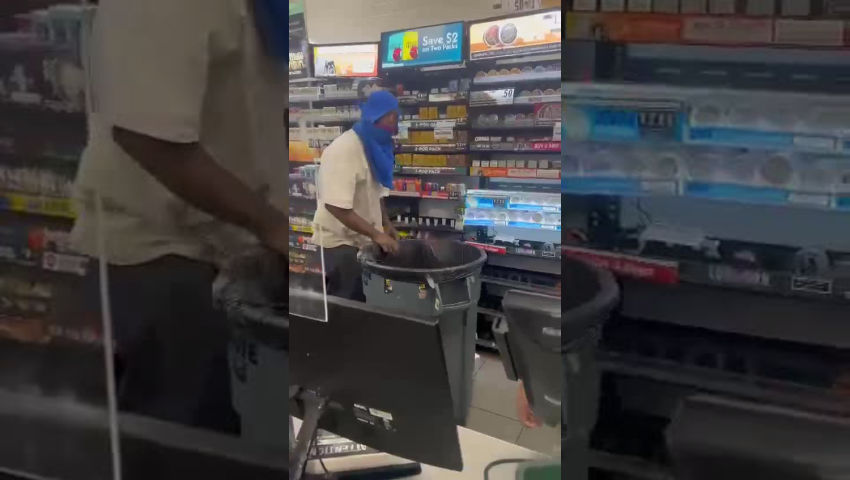
Find the location of `trash can`. trash can is located at coordinates (412, 291).